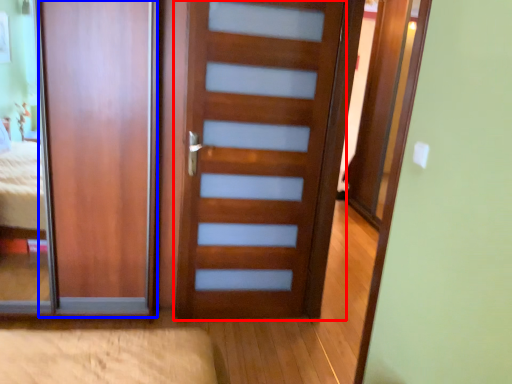
Question: Which object appears farthest to the camera in this image, door (highlighted by a red box) or door (highlighted by a blue box)?

Choices:
 (A) door
 (B) door

Answer: (B)